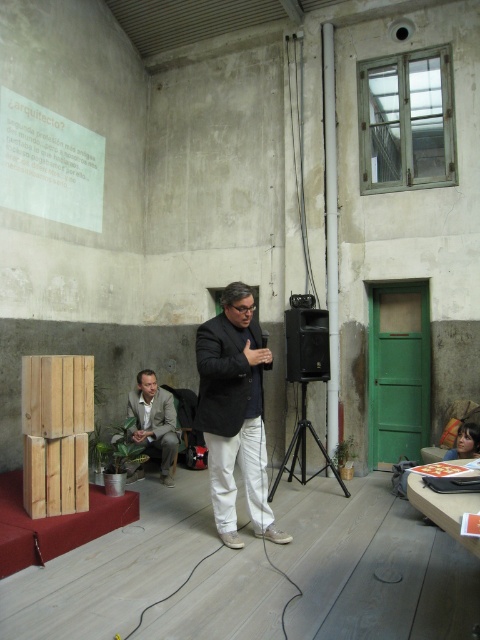
You are an event planner setting up for a presentation. You see the light brown fabric suit at lower left and the black metal tripod at center. Which object is positioned higher in the image?

The light brown fabric suit at lower left is located above the black metal tripod at center, so it is positioned higher in the image.

You are an event planner organizing a presentation in the lecture hall. You need to ensure there is enough space between the matte black suit at center and the light brown fabric suit at lower left for attendees to walk through. The average attendee requires 3 feet of space. Is the current distance sufficient?

The matte black suit at center and the light brown fabric suit at lower left are 5.47 feet apart, which is more than the required 3 feet of space. Therefore, the current distance is sufficient for attendees to walk through.

You are an event planner arranging a small presentation. You need to place a 1.2 meter wide screen between the light brown fabric suit at lower left and the black metal tripod at center. Will there be enough space?

The light brown fabric suit at lower left has a lesser width compared to black metal tripod at center. Since the screen is 1.2 meters wide, it depends on the actual distance between them. However, the description only states the width comparison between the objects, not the distance between them. Therefore, we cannot determine if the screen will fit based on the given information.